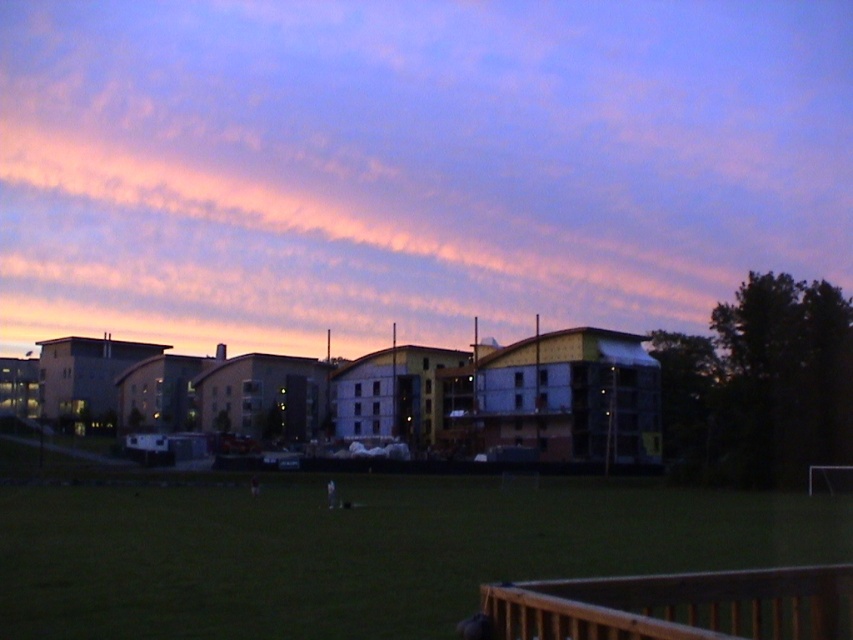
Question: Which is nearer to the green grass at center?

Choices:
 (A) brown wooden rail at lower right
 (B) pink cloud at upper center

Answer: (A)

Question: Is pink cloud at upper center below brown wooden rail at lower right?

Choices:
 (A) no
 (B) yes

Answer: (A)

Question: Is pink cloud at upper center thinner than green grass at center?

Choices:
 (A) no
 (B) yes

Answer: (A)

Question: Which of the following is the farthest from the observer?

Choices:
 (A) green grass at center
 (B) brown wooden rail at lower right
 (C) pink cloud at upper center

Answer: (C)

Question: Which object is closer to the camera taking this photo?

Choices:
 (A) brown wooden rail at lower right
 (B) green grass at center
 (C) pink cloud at upper center

Answer: (A)

Question: Is green grass at center to the left of brown wooden rail at lower right from the viewer's perspective?

Choices:
 (A) no
 (B) yes

Answer: (B)